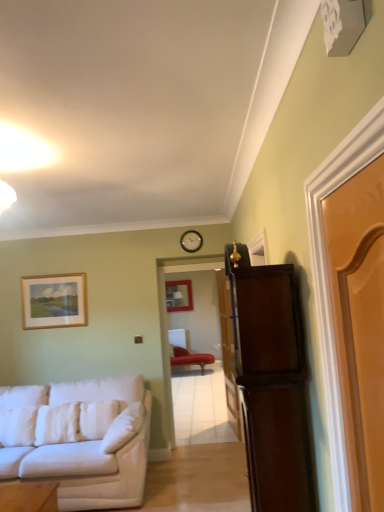
Question: Is light brown wooden door at right, arranged as the third door when viewed from the back, to the left of white fabric couch at left from the viewer's perspective?

Choices:
 (A) no
 (B) yes

Answer: (A)

Question: Does light brown wooden door at right, arranged as the third door when viewed from the back, come behind white fabric couch at left?

Choices:
 (A) no
 (B) yes

Answer: (A)

Question: Can you confirm if light brown wooden door at right, arranged as the third door when viewed from the back, is wider than white fabric couch at left?

Choices:
 (A) yes
 (B) no

Answer: (B)

Question: Considering the relative sizes of light brown wooden door at right, arranged as the third door when viewed from the back, and white fabric couch at left in the image provided, is light brown wooden door at right, arranged as the third door when viewed from the back, smaller than white fabric couch at left?

Choices:
 (A) no
 (B) yes

Answer: (B)

Question: Is light brown wooden door at right, which is counted as the first door, starting from the front, at the right side of white fabric couch at left?

Choices:
 (A) no
 (B) yes

Answer: (B)

Question: From the image's perspective, is dark wood cabinet at right above or below velvet red chaise at center?

Choices:
 (A) below
 (B) above

Answer: (B)

Question: Looking at their shapes, would you say dark wood cabinet at right is wider or thinner than velvet red chaise at center?

Choices:
 (A) thin
 (B) wide

Answer: (A)

Question: Would you say dark wood cabinet at right is inside or outside velvet red chaise at center?

Choices:
 (A) outside
 (B) inside

Answer: (A)

Question: From their relative heights in the image, would you say dark wood cabinet at right is taller or shorter than velvet red chaise at center?

Choices:
 (A) tall
 (B) short

Answer: (A)

Question: Choose the correct answer: Is metallic round clock at upper center inside light brown wooden door at right, arranged as the third door when viewed from the back, or outside it?

Choices:
 (A) inside
 (B) outside

Answer: (B)

Question: Is metallic round clock at upper center in front of or behind light brown wooden door at right, which is counted as the first door, starting from the front, in the image?

Choices:
 (A) behind
 (B) front

Answer: (A)

Question: Would you say metallic round clock at upper center is to the left or to the right of light brown wooden door at right, which is counted as the first door, starting from the front, in the picture?

Choices:
 (A) right
 (B) left

Answer: (B)

Question: From a real-world perspective, is metallic round clock at upper center positioned above or below light brown wooden door at right, which is counted as the first door, starting from the front?

Choices:
 (A) above
 (B) below

Answer: (A)

Question: From the image's perspective, relative to white soft pillow at lower left, which ranks as the first pillow in left-to-right order, is dark wood cabinet at right above or below?

Choices:
 (A) below
 (B) above

Answer: (B)

Question: From a real-world perspective, is dark wood cabinet at right positioned above or below white soft pillow at lower left, which ranks as the first pillow in left-to-right order?

Choices:
 (A) above
 (B) below

Answer: (A)